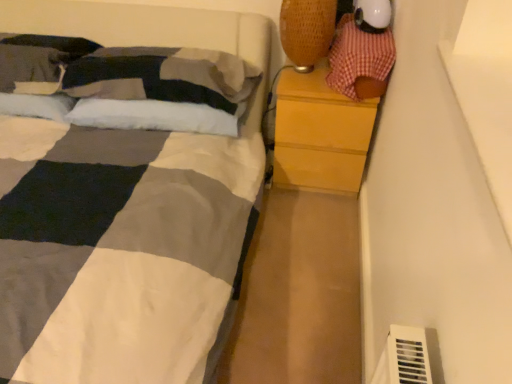
Question: Is checkered fabric toy at upper right further to camera compared to woven fabric table lamp at upper right?

Choices:
 (A) no
 (B) yes

Answer: (A)

Question: Does checkered fabric toy at upper right have a greater height compared to woven fabric table lamp at upper right?

Choices:
 (A) yes
 (B) no

Answer: (B)

Question: From the image's perspective, would you say checkered fabric toy at upper right is positioned over woven fabric table lamp at upper right?

Choices:
 (A) yes
 (B) no

Answer: (B)

Question: From a real-world perspective, is checkered fabric toy at upper right under woven fabric table lamp at upper right?

Choices:
 (A) no
 (B) yes

Answer: (B)

Question: Considering the relative positions of checkered fabric toy at upper right and woven fabric table lamp at upper right in the image provided, is checkered fabric toy at upper right in front of woven fabric table lamp at upper right?

Choices:
 (A) yes
 (B) no

Answer: (A)

Question: Does checkered fabric toy at upper right appear on the right side of woven fabric table lamp at upper right?

Choices:
 (A) yes
 (B) no

Answer: (A)

Question: Is woven fabric table lamp at upper right placed right next to checkered fabric toy at upper right?

Choices:
 (A) yes
 (B) no

Answer: (B)

Question: Could you tell me if woven fabric table lamp at upper right is facing checkered fabric toy at upper right?

Choices:
 (A) no
 (B) yes

Answer: (A)

Question: Considering the relative sizes of woven fabric table lamp at upper right and checkered fabric toy at upper right in the image provided, is woven fabric table lamp at upper right wider than checkered fabric toy at upper right?

Choices:
 (A) no
 (B) yes

Answer: (A)

Question: Does woven fabric table lamp at upper right have a larger size compared to checkered fabric toy at upper right?

Choices:
 (A) no
 (B) yes

Answer: (A)

Question: Is woven fabric table lamp at upper right positioned behind checkered fabric toy at upper right?

Choices:
 (A) yes
 (B) no

Answer: (A)

Question: Would you say woven fabric table lamp at upper right is outside checkered fabric toy at upper right?

Choices:
 (A) yes
 (B) no

Answer: (A)

Question: Does wooden chest of drawers at right have a greater width compared to white soft pillow at upper left, the 2th pillow in the left-to-right sequence?

Choices:
 (A) yes
 (B) no

Answer: (A)